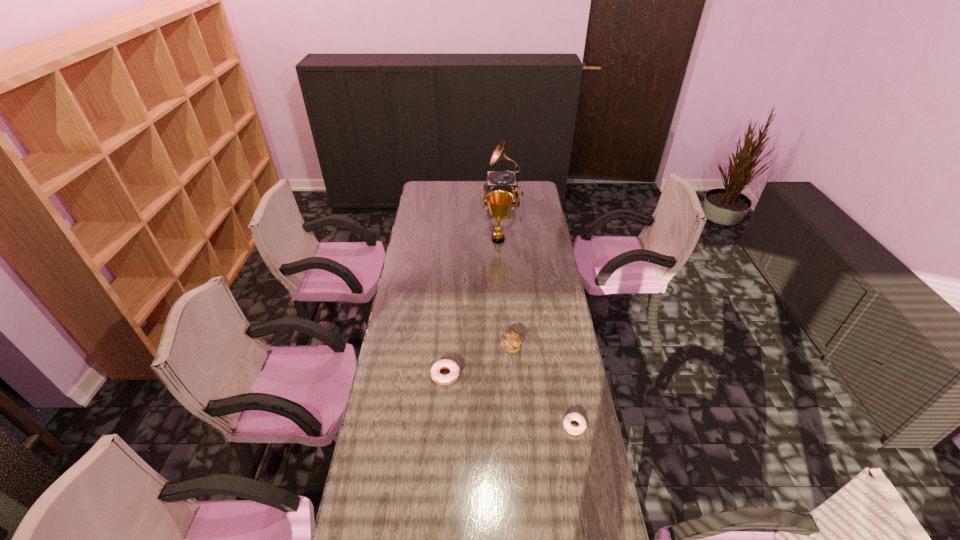
What are the coordinates of `free space located 0.090m on the horn of the record player` in the screenshot? It's located at (468, 197).

What are the coordinates of `vacant space located 0.160m on the front view with handles of the award` in the screenshot? It's located at (499, 267).

Where is `vacant space located 0.280m on the back of the muffin`? The image size is (960, 540). vacant space located 0.280m on the back of the muffin is located at coordinates (507, 291).

The width and height of the screenshot is (960, 540). Identify the location of vacant region located on the front of the second shortest object. (437, 490).

In order to click on free space located on the front of the shorter doughnut in this screenshot , I will do `click(587, 498)`.

I want to click on object present at the far edge, so click(506, 180).

I want to click on record player at the right edge, so click(x=506, y=180).

Find the location of `doughnut present at the right edge`. doughnut present at the right edge is located at coordinates (575, 416).

The image size is (960, 540). What are the coordinates of `object present at the far right corner` in the screenshot? It's located at (506, 180).

I want to click on free space at the far edge of the desktop, so click(x=458, y=180).